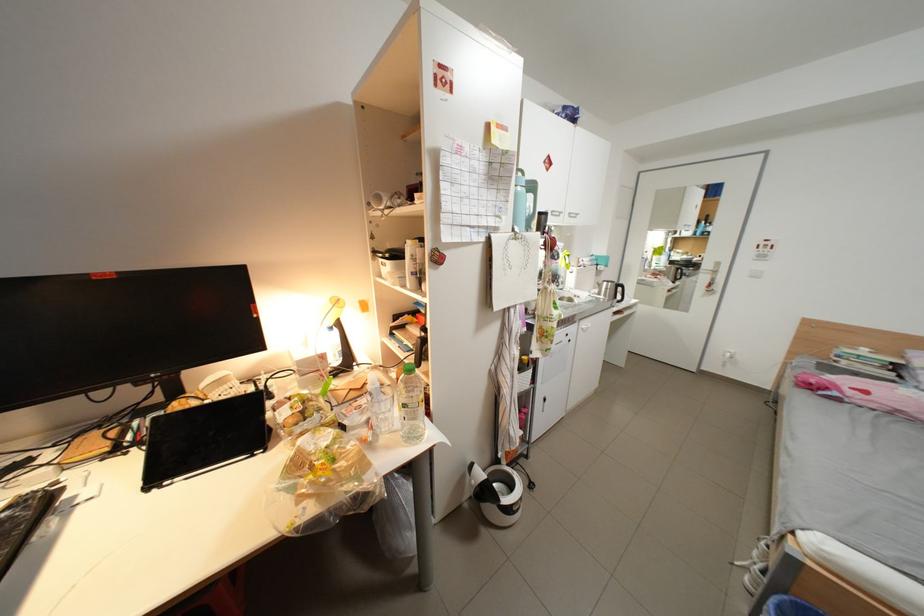
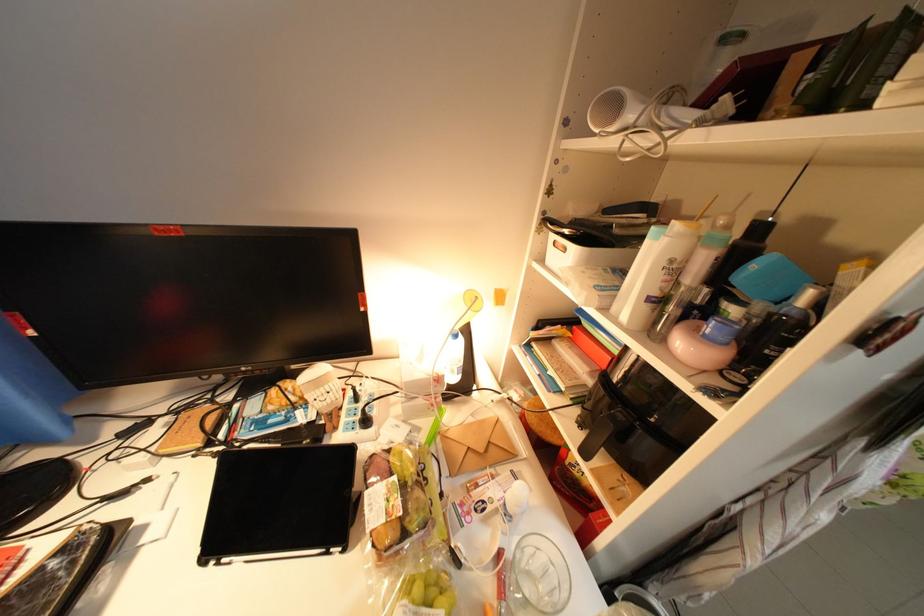
In the second image, find the point that corresponds to [307,400] in the first image.

(407, 479)